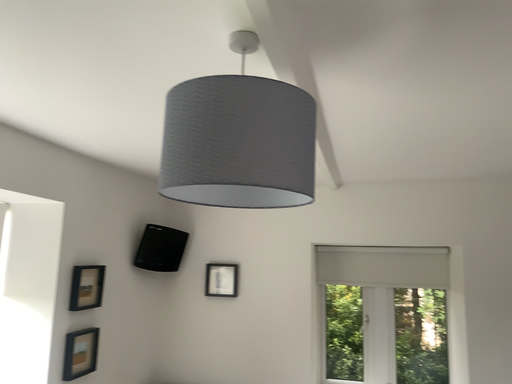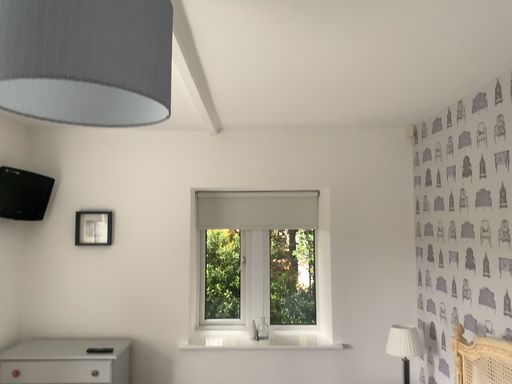
Question: How did the camera likely rotate when shooting the video?

Choices:
 (A) rotated right
 (B) rotated left

Answer: (A)